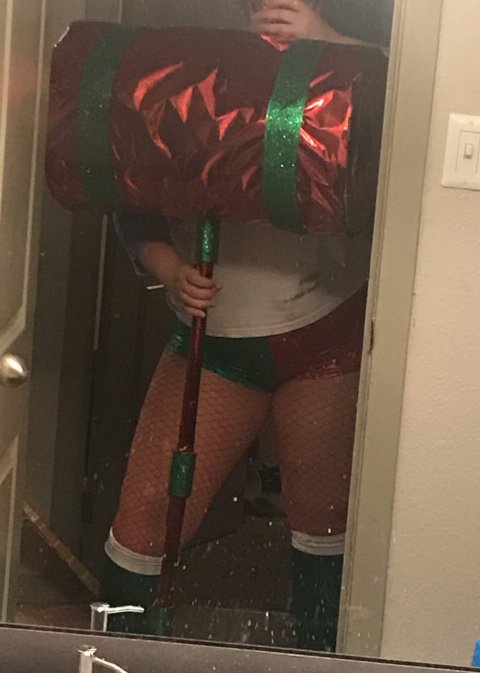
Where is `wall`? The image size is (480, 673). wall is located at coordinates (432, 524).